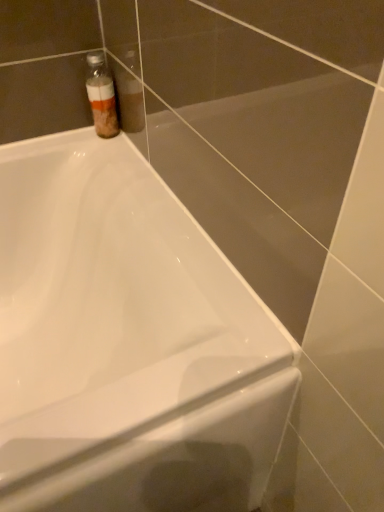
Locate an element on the screen. The height and width of the screenshot is (512, 384). vacant area that lies in front of translucent plastic bottle at upper left is located at coordinates (101, 173).